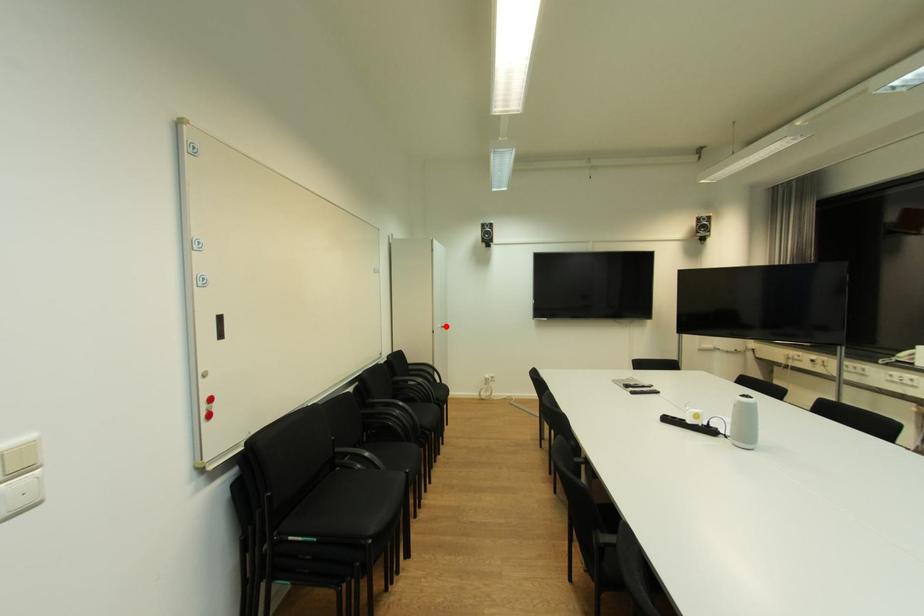
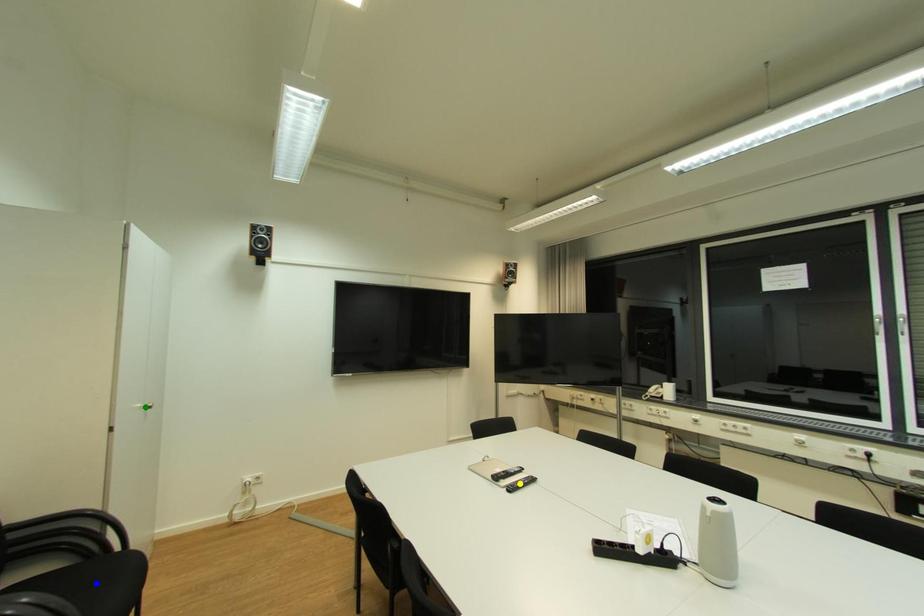
Question: I am providing you with two images of the same scene from different viewpoints. A red point is marked on the first image. You are given multiple points on the second image. Can you choose the point in image 2 that corresponds to the point in image 1?

Choices:
 (A) blue point
 (B) yellow point
 (C) green point

Answer: (C)